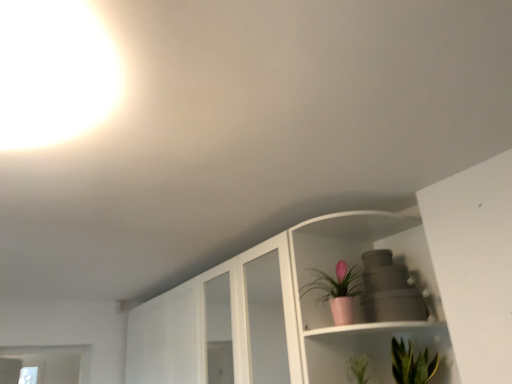
Question: Which direction should I rotate to face pink matte pot at upper center, the second houseplant from the bottom, — up or down?

Choices:
 (A) down
 (B) up

Answer: (A)

Question: Is pink matte pot at upper center, which is the second houseplant from right to left, oriented towards green leafy plant at lower right, the 2th houseplant positioned from the left?

Choices:
 (A) yes
 (B) no

Answer: (B)

Question: Can you confirm if pink matte pot at upper center, which is the second houseplant from right to left, is taller than green leafy plant at lower right, which is the 1th houseplant in bottom-to-top order?

Choices:
 (A) yes
 (B) no

Answer: (A)

Question: Considering the relative positions of pink matte pot at upper center, which is the second houseplant from right to left, and green leafy plant at lower right, which is the second houseplant in top-to-bottom order, in the image provided, is pink matte pot at upper center, which is the second houseplant from right to left, to the left of green leafy plant at lower right, which is the second houseplant in top-to-bottom order, from the viewer's perspective?

Choices:
 (A) no
 (B) yes

Answer: (B)

Question: From the image's perspective, is pink matte pot at upper center, which is the second houseplant from right to left, below green leafy plant at lower right, which is the second houseplant in top-to-bottom order?

Choices:
 (A) yes
 (B) no

Answer: (B)

Question: Does pink matte pot at upper center, the second houseplant from the bottom, contain green leafy plant at lower right, which is the second houseplant in top-to-bottom order?

Choices:
 (A) yes
 (B) no

Answer: (B)

Question: From a real-world perspective, is pink matte pot at upper center, which is the first houseplant in left-to-right order, under green leafy plant at lower right, the 2th houseplant positioned from the left?

Choices:
 (A) no
 (B) yes

Answer: (A)

Question: Is green leafy plant at lower right, the 2th houseplant positioned from the left, located outside pink matte pot at upper center, which is the first houseplant in left-to-right order?

Choices:
 (A) no
 (B) yes

Answer: (B)

Question: Is green leafy plant at lower right, which is the 1th houseplant in bottom-to-top order, bigger than pink matte pot at upper center, which is the second houseplant from right to left?

Choices:
 (A) no
 (B) yes

Answer: (B)

Question: From a real-world perspective, is green leafy plant at lower right, the 2th houseplant positioned from the left, physically below pink matte pot at upper center, the 1th houseplant positioned from the top?

Choices:
 (A) no
 (B) yes

Answer: (B)

Question: Is green leafy plant at lower right, the 2th houseplant positioned from the left, far from pink matte pot at upper center, which is the second houseplant from right to left?

Choices:
 (A) no
 (B) yes

Answer: (A)

Question: Can you confirm if green leafy plant at lower right, marked as the 1th houseplant in a right-to-left arrangement, is shorter than pink matte pot at upper center, which is the first houseplant in left-to-right order?

Choices:
 (A) no
 (B) yes

Answer: (B)

Question: Does green leafy plant at lower right, which is the 1th houseplant in bottom-to-top order, appear on the right side of pink matte pot at upper center, the second houseplant from the bottom?

Choices:
 (A) yes
 (B) no

Answer: (A)

Question: Visually, is pink matte pot at upper center, which is the first houseplant in left-to-right order, positioned to the left or to the right of green leafy plant at lower right, which is the second houseplant in top-to-bottom order?

Choices:
 (A) left
 (B) right

Answer: (A)